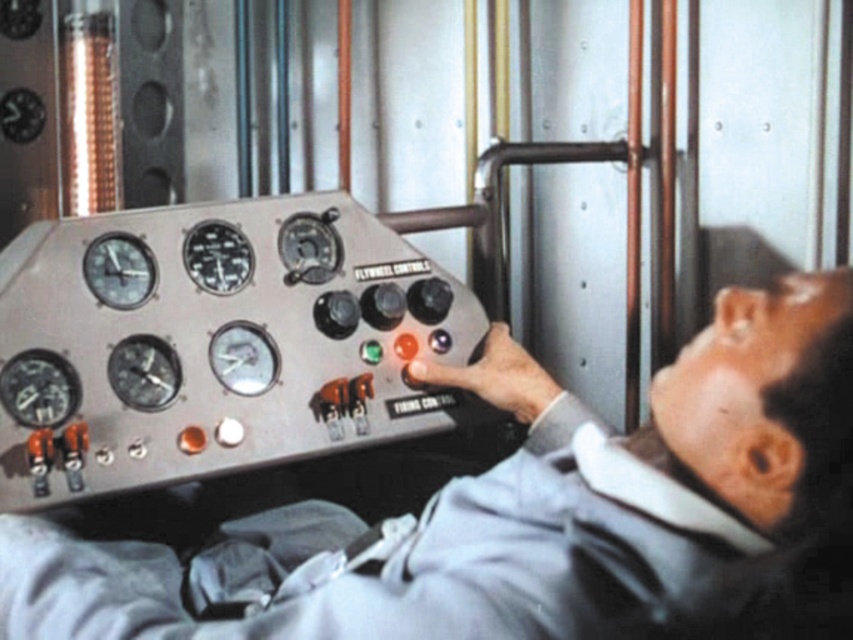
Is metallic gray control panel at center below metallic gauge at upper left?

Yes, metallic gray control panel at center is below metallic gauge at upper left.

Between point (485, 380) and point (186, 266), which one is positioned in front?

Positioned in front is point (485, 380).

I want to click on metallic gray control panel at center, so click(x=544, y=506).

Is metallic gray control panel at center above metallic clock at upper left?

Actually, metallic gray control panel at center is below metallic clock at upper left.

Does point (329, 605) lie in front of point (96, 296)?

Yes.

Locate an element on the screen. The width and height of the screenshot is (853, 640). metallic gray control panel at center is located at coordinates (544, 506).

What do you see at coordinates (119, 269) in the screenshot?
I see `metallic clock at upper left` at bounding box center [119, 269].

Between point (102, 246) and point (233, 227), which one is positioned in front?

Point (102, 246) is in front.

Is point (114, 300) farther from camera compared to point (224, 276)?

No, (114, 300) is in front of (224, 276).

Locate an element on the screen. This screenshot has height=640, width=853. metallic clock at upper left is located at coordinates [119, 269].